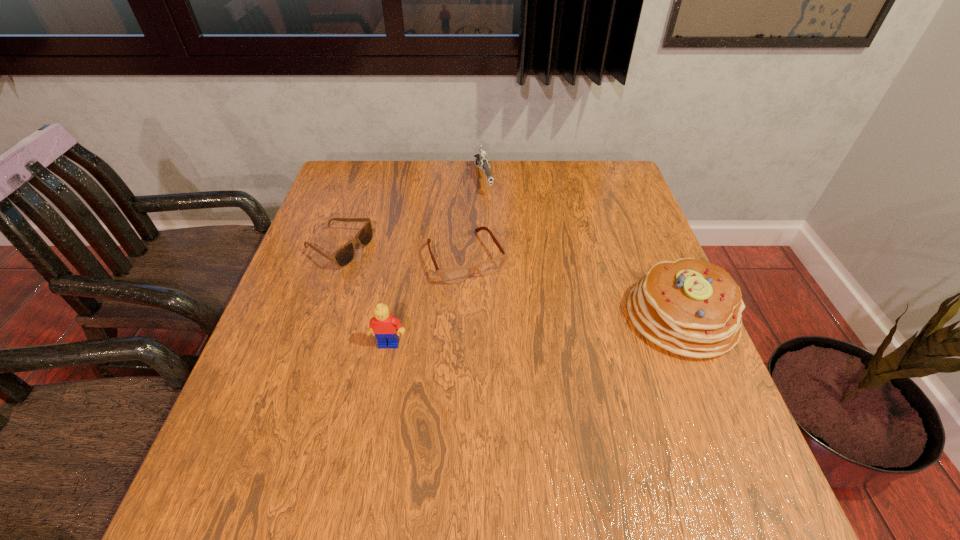
This screenshot has width=960, height=540. Find the location of `vacant space at the far edge of the desktop`. vacant space at the far edge of the desktop is located at coordinates (491, 190).

The image size is (960, 540). I want to click on vacant region at the near edge of the desktop, so click(x=445, y=450).

Locate an element on the screen. vacant space at the left edge is located at coordinates (x=292, y=275).

In the image, there is a desktop. Where is `vacant space at the right edge`? Image resolution: width=960 pixels, height=540 pixels. vacant space at the right edge is located at coordinates [613, 254].

You are a GUI agent. You are given a task and a screenshot of the screen. Output one action in this format:
    pyautogui.click(x=<x>, y=<y>)
    Task: Click on the free space at the far left corner of the desktop
    
    Given the screenshot: What is the action you would take?
    pyautogui.click(x=376, y=185)

The height and width of the screenshot is (540, 960). In order to click on vacant space at the near left corner of the desktop in this screenshot , I will do `click(270, 443)`.

In order to click on vacant region at the near right corner of the desktop in this screenshot , I will do `click(734, 437)`.

Identify the location of free point between the farthest object and the spectacles. point(474,218).

Locate an element on the screen. The image size is (960, 540). unoccupied position between the spectacles and the second object from left to right is located at coordinates (427, 300).

Locate an element on the screen. This screenshot has height=540, width=960. free space between the gun and the sunglasses is located at coordinates (411, 214).